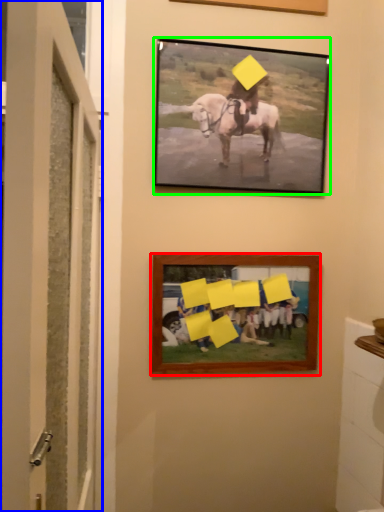
Question: Which object is positioned farthest from picture frame (highlighted by a red box)? Select from door (highlighted by a blue box) and picture frame (highlighted by a green box).

Choices:
 (A) door
 (B) picture frame

Answer: (A)